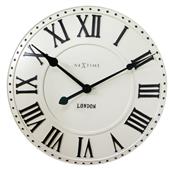
Where is `round clock`? round clock is located at coordinates (121, 94), (134, 169).